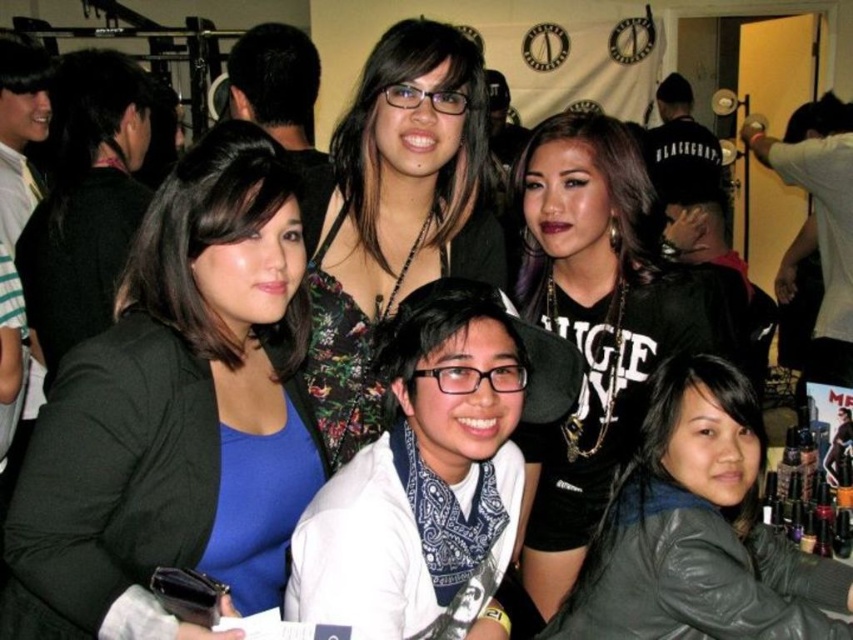
You are a photographer at this event and need to adjust the lighting for a closeup shot of the two clothing items mentioned. Since the floral fabric dress at center is narrower than the leather jacket at lower right, which one requires more space to fully capture in the frame?

The leather jacket at lower right requires more space in the frame because its width is greater than the floral fabric dress at center.

You are a photographer adjusting the camera settings to ensure all clothing items are in focus. The matte black blazer at left and the black leather jacket at center are both in the frame. Which clothing item is shorter in height?

The matte black blazer at left has a lesser height compared to the black leather jacket at center, so the matte black blazer at left is shorter in height.